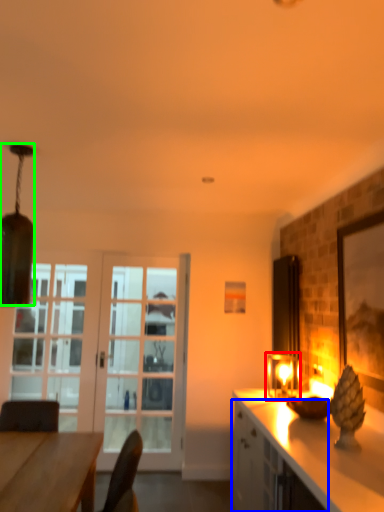
Question: Which object is positioned closest to light fixture (highlighted by a red box)? Select from cabinetry (highlighted by a blue box) and lamp (highlighted by a green box).

Choices:
 (A) cabinetry
 (B) lamp

Answer: (A)